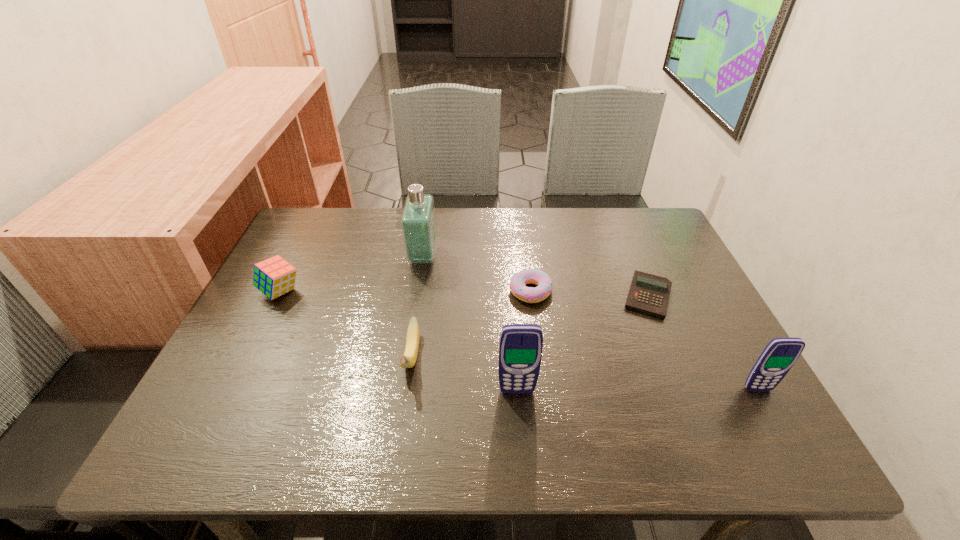
The image size is (960, 540). I want to click on vacant point at the far edge, so click(502, 212).

Where is `vacant area at the near edge of the desktop`? vacant area at the near edge of the desktop is located at coordinates (297, 383).

In order to click on free space at the left edge of the desktop in this screenshot , I will do `click(282, 346)`.

At what (x,y) coordinates should I click in order to perform the action: click on free space at the right edge. Please return your answer as a coordinate pair (x, y). Looking at the image, I should click on (677, 316).

In the image, there is a desktop. Where is `free region at the far left corner`? The height and width of the screenshot is (540, 960). free region at the far left corner is located at coordinates (324, 235).

You are a GUI agent. You are given a task and a screenshot of the screen. Output one action in this format:
    pyautogui.click(x=<x>, y=<y>)
    Task: Click on the vacant area that lies between the cube and the left cellular telephone
    This screenshot has height=540, width=960.
    Given the screenshot: What is the action you would take?
    pyautogui.click(x=398, y=341)

The width and height of the screenshot is (960, 540). What are the coordinates of `blank region between the doughnut and the perfume` in the screenshot? It's located at (477, 274).

Where is `empty location between the leftmost object and the sixth shortest object`? Image resolution: width=960 pixels, height=540 pixels. empty location between the leftmost object and the sixth shortest object is located at coordinates (398, 341).

This screenshot has height=540, width=960. Find the location of `free point between the doughnut and the cube`. free point between the doughnut and the cube is located at coordinates (405, 292).

Find the location of a particular element. This screenshot has width=960, height=540. free space between the banana and the left cellular telephone is located at coordinates point(464,374).